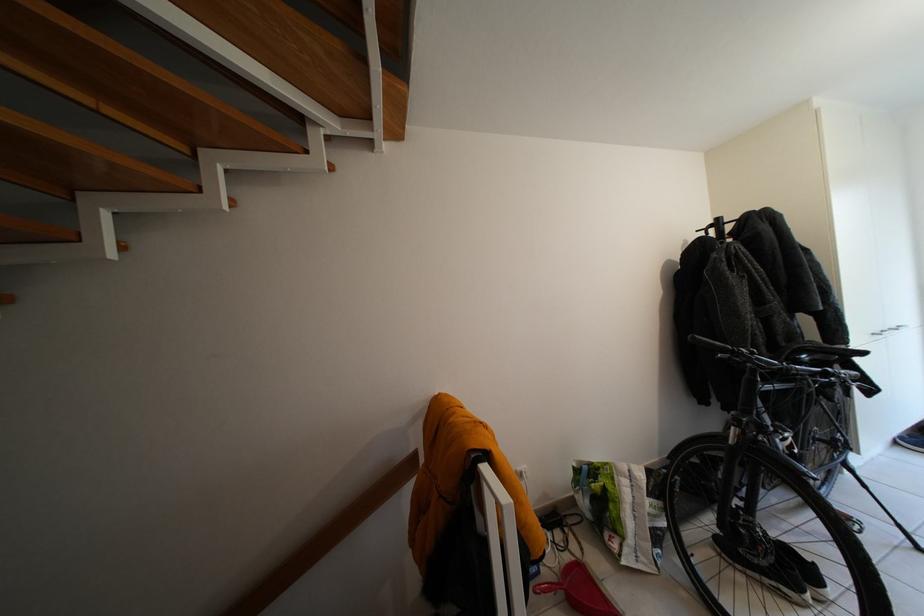
Where would you sit the black bicycle saddle? Please return your answer as a coordinate pair (x, y).

(821, 353)